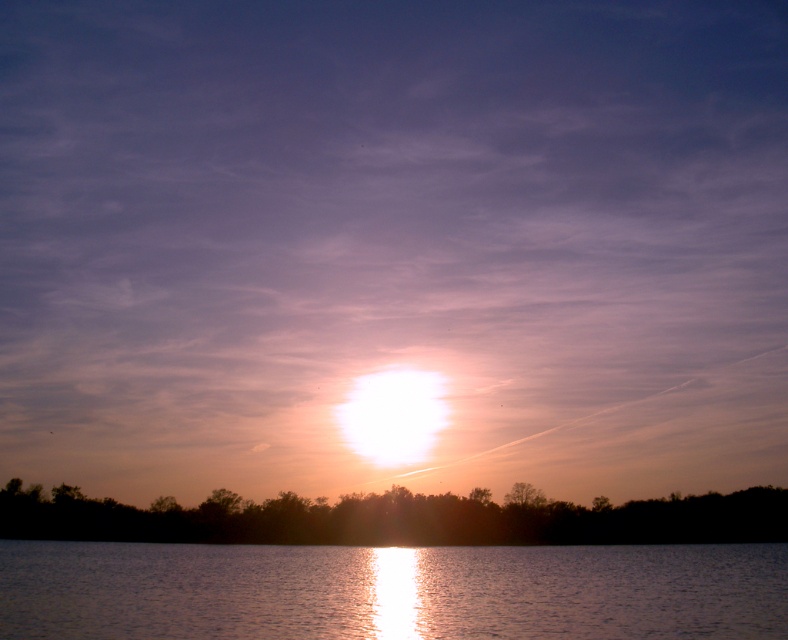
You are standing on the shore looking at the sunset. You see the glistening water at center and the silky water at lower center. Which body of water appears nearer to you?

The glistening water at center appears nearer to you because it is closer to the viewer than the silky water at lower center.

You are standing on the shore looking at the sunset. There is a point marked at coordinates (389, 592) in the image. Based on the scene description, what does this point most likely represent?

The point at coordinates (389, 592) corresponds to glistening water at center, which is reflecting the sunset light, creating a shimmering path.